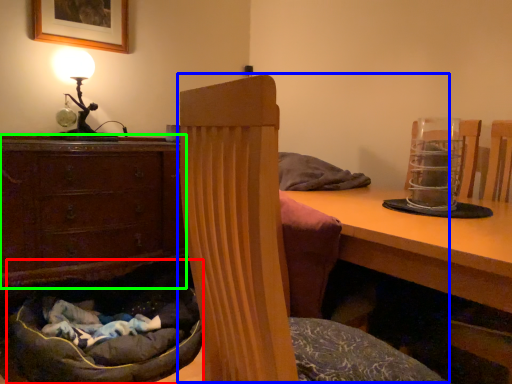
Question: Which is farther away from bean bag chair (highlighted by a red box)? bean bag chair (highlighted by a blue box) or chest of drawers (highlighted by a green box)?

Choices:
 (A) bean bag chair
 (B) chest of drawers

Answer: (A)